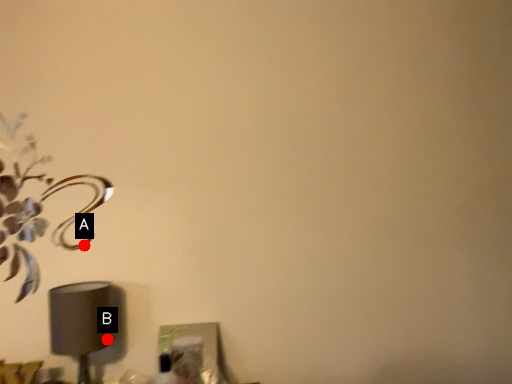
Question: Two points are circled on the image, labeled by A and B beside each circle. Among these points, which one is farthest from the camera?

Choices:
 (A) A is further
 (B) B is further

Answer: (A)